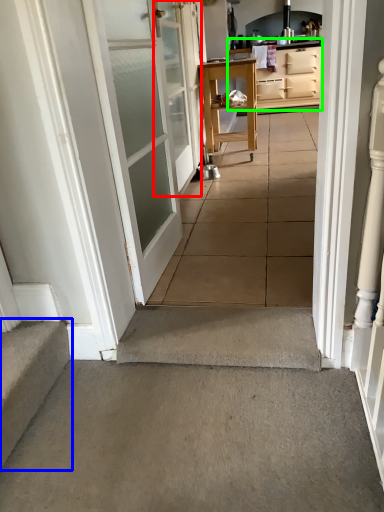
Question: Considering the real-world distances, which object is farthest from door (highlighted by a red box)? stairs (highlighted by a blue box) or cabinetry (highlighted by a green box)?

Choices:
 (A) stairs
 (B) cabinetry

Answer: (B)